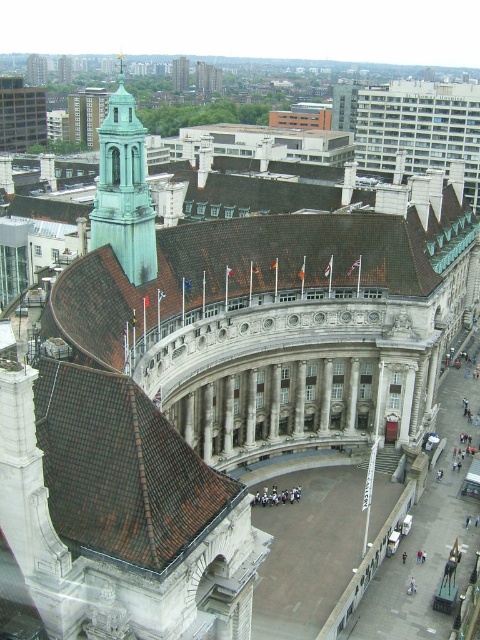
Can you confirm if green stone tower at upper left is thinner than green copper spire at upper left?

No, green stone tower at upper left is not thinner than green copper spire at upper left.

Image resolution: width=480 pixels, height=640 pixels. Describe the element at coordinates (36, 68) in the screenshot. I see `green stone tower at upper left` at that location.

At what (x,y) coordinates should I click in order to perform the action: click on green stone tower at upper left. Please return your answer as a coordinate pair (x, y). Looking at the image, I should click on (36, 68).

Which is behind, point (110, 557) or point (179, 70)?

The point (179, 70) is more distant.

Is brown tile roof at upper left wider than green copper tower at upper left?

Correct, the width of brown tile roof at upper left exceeds that of green copper tower at upper left.

Does point (132, 506) come behind point (171, 68)?

No, it is not.

At what (x,y) coordinates should I click in order to perform the action: click on brown tile roof at upper left. Please return your answer as a coordinate pair (x, y). The image size is (480, 640). Looking at the image, I should click on (121, 468).

Can you confirm if green copper bell tower at upper left is taller than green copper tower at upper left?

Correct, green copper bell tower at upper left is much taller as green copper tower at upper left.

The height and width of the screenshot is (640, 480). What are the coordinates of `green copper bell tower at upper left` in the screenshot? It's located at (123, 192).

Locate an element on the screen. The width and height of the screenshot is (480, 640). green copper bell tower at upper left is located at coordinates (123, 192).